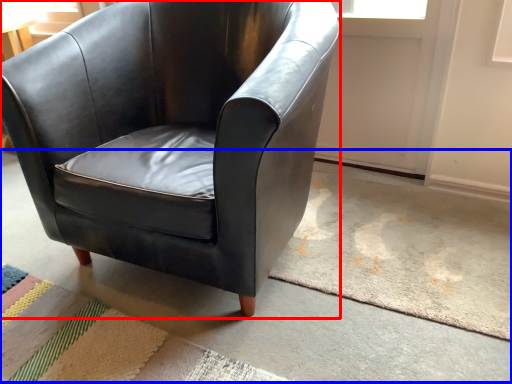
Question: Which object is closer to the camera taking this photo, chair (highlighted by a red box) or concrete (highlighted by a blue box)?

Choices:
 (A) chair
 (B) concrete

Answer: (B)